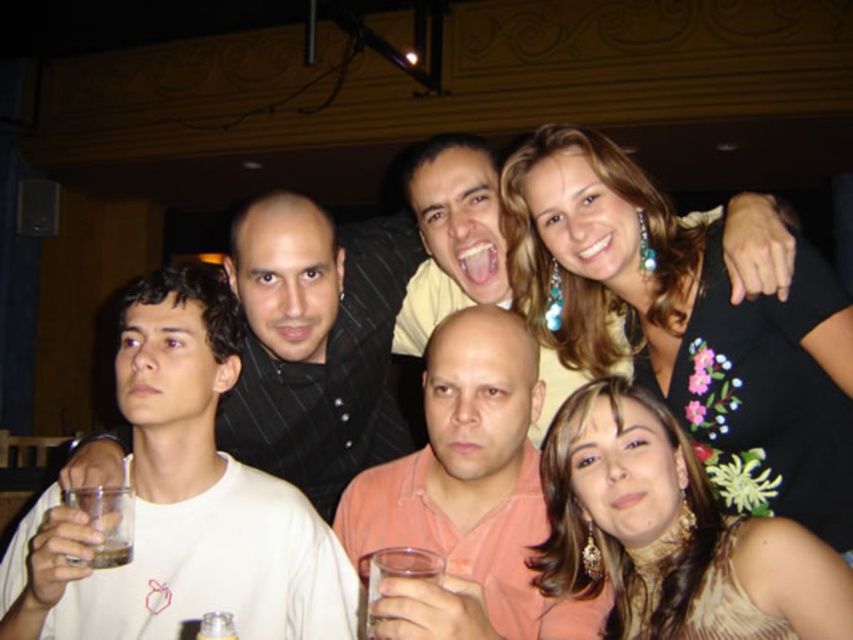
Does orange cotton shirt at center appear over translucent glass at lower left?

No.

How distant is orange cotton shirt at center from translucent glass at lower left?

orange cotton shirt at center is 20.89 inches from translucent glass at lower left.

In order to click on orange cotton shirt at center in this screenshot , I will do `click(468, 496)`.

Can you confirm if white matte shirt at left is positioned below translucent glass at lower left?

Incorrect, white matte shirt at left is not positioned below translucent glass at lower left.

Describe the element at coordinates (180, 502) in the screenshot. I see `white matte shirt at left` at that location.

Where is `white matte shirt at left`? The width and height of the screenshot is (853, 640). white matte shirt at left is located at coordinates (180, 502).

Which of these two, brown textured dress at center or orange cotton shirt at center, stands taller?

orange cotton shirt at center

Does brown textured dress at center have a greater width compared to orange cotton shirt at center?

No.

Which is behind, point (659, 563) or point (453, 396)?

Point (453, 396)

Identify the location of brown textured dress at center. Image resolution: width=853 pixels, height=640 pixels. (668, 529).